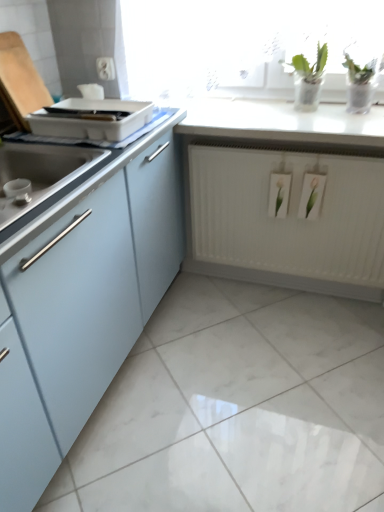
Question: Is matte light blue cabinet at left outside of white plastic tray at upper left?

Choices:
 (A) no
 (B) yes

Answer: (B)

Question: Does matte light blue cabinet at left have a lesser height compared to white plastic tray at upper left?

Choices:
 (A) yes
 (B) no

Answer: (B)

Question: Is matte light blue cabinet at left far from white plastic tray at upper left?

Choices:
 (A) no
 (B) yes

Answer: (A)

Question: From the image's perspective, is matte light blue cabinet at left under white plastic tray at upper left?

Choices:
 (A) yes
 (B) no

Answer: (A)

Question: Is matte light blue cabinet at left positioned before white plastic tray at upper left?

Choices:
 (A) yes
 (B) no

Answer: (A)

Question: Is white matte radiator at center wider or thinner than white glossy countertop at upper center?

Choices:
 (A) wide
 (B) thin

Answer: (B)

Question: From the image's perspective, relative to white glossy countertop at upper center, is white matte radiator at center above or below?

Choices:
 (A) below
 (B) above

Answer: (A)

Question: Is white matte radiator at center in front of or behind white glossy countertop at upper center in the image?

Choices:
 (A) behind
 (B) front

Answer: (A)

Question: From a real-world perspective, is white matte radiator at center physically located above or below white glossy countertop at upper center?

Choices:
 (A) above
 (B) below

Answer: (B)

Question: Choose the correct answer: Is matte light blue cabinet at left inside white matte radiator at center or outside it?

Choices:
 (A) outside
 (B) inside

Answer: (A)

Question: In terms of width, does matte light blue cabinet at left look wider or thinner when compared to white matte radiator at center?

Choices:
 (A) wide
 (B) thin

Answer: (A)

Question: Does point (84, 339) appear closer or farther from the camera than point (208, 237)?

Choices:
 (A) farther
 (B) closer

Answer: (B)

Question: In terms of height, does matte light blue cabinet at left look taller or shorter compared to white matte radiator at center?

Choices:
 (A) short
 (B) tall

Answer: (B)

Question: Is white glossy countertop at upper center wider or thinner than white matte radiator at center?

Choices:
 (A) thin
 (B) wide

Answer: (B)

Question: Looking at the image, does white glossy countertop at upper center seem bigger or smaller compared to white matte radiator at center?

Choices:
 (A) small
 (B) big

Answer: (A)